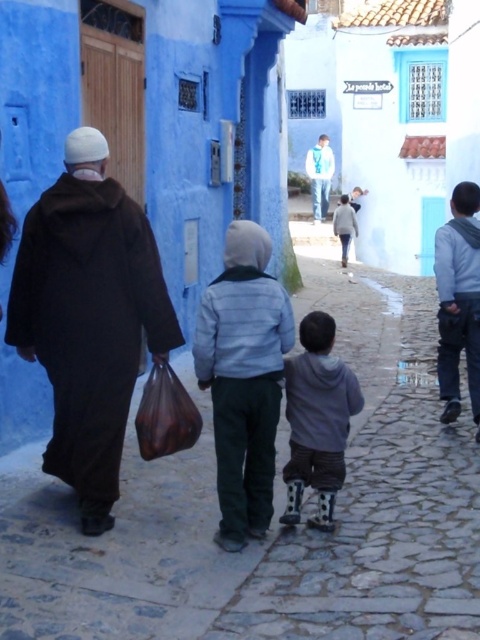
Question: Can you confirm if dark brown woolen robe at left is positioned above gray fleece hoodie at center?

Choices:
 (A) yes
 (B) no

Answer: (A)

Question: Which point is closer to the camera?

Choices:
 (A) gray fleece jacket at right
 (B) light gray fabric robe at center
 (C) dark brown woolen robe at left
 (D) light blue striped jacket at center

Answer: (C)

Question: Is brown leather bag at lower left to the right of white matte jacket at center from the viewer's perspective?

Choices:
 (A) no
 (B) yes

Answer: (A)

Question: Which point is closer to the camera?

Choices:
 (A) (180, 340)
 (B) (85, 310)
 (C) (225, 420)
 (D) (352, 212)

Answer: (B)

Question: Can you confirm if brown leather bag at lower left is wider than light gray fabric robe at center?

Choices:
 (A) yes
 (B) no

Answer: (A)

Question: Which point is farther to the camera?

Choices:
 (A) brown leather bag at lower left
 (B) white matte jacket at center

Answer: (B)